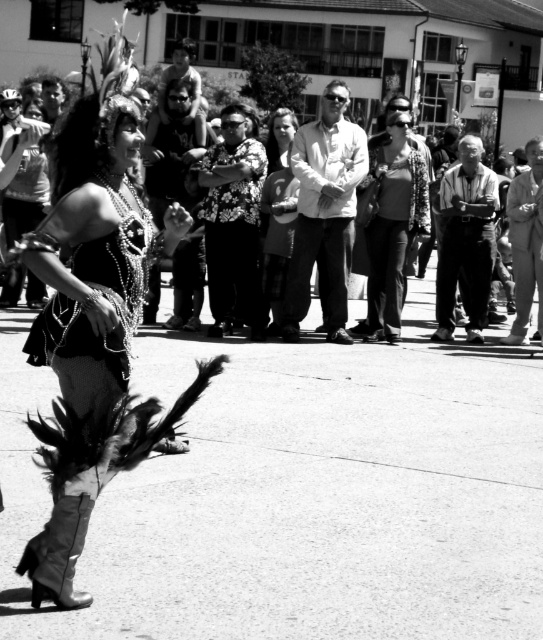
Who is higher up, matte black clothing at center or smooth leather jacket at upper center?

smooth leather jacket at upper center is above.

Which of these two, matte black clothing at center or smooth leather jacket at upper center, stands taller?

Standing taller between the two is matte black clothing at center.

Locate an element on the screen. The width and height of the screenshot is (543, 640). matte black clothing at center is located at coordinates (363, 214).

Based on the photo, is light beige cotton shirt at right above smooth leather jacket at upper center?

No, light beige cotton shirt at right is not above smooth leather jacket at upper center.

Is point (514, 276) closer to viewer compared to point (168, 72)?

Yes.

At what (x,y) coordinates should I click in order to perform the action: click on light beige cotton shirt at right. Please return your answer as a coordinate pair (x, y). Looking at the image, I should click on (526, 241).

Is point (185, 141) positioned in front of point (159, 108)?

That is True.

Does bearded man with long hair at center have a smaller size compared to smooth leather jacket at upper center?

Correct, bearded man with long hair at center occupies less space than smooth leather jacket at upper center.

Is point (150, 198) more distant than point (168, 81)?

No, (150, 198) is closer to viewer.

At what (x,y) coordinates should I click in order to perform the action: click on bearded man with long hair at center. Please return your answer as a coordinate pair (x, y). This screenshot has height=640, width=543. Looking at the image, I should click on (172, 147).